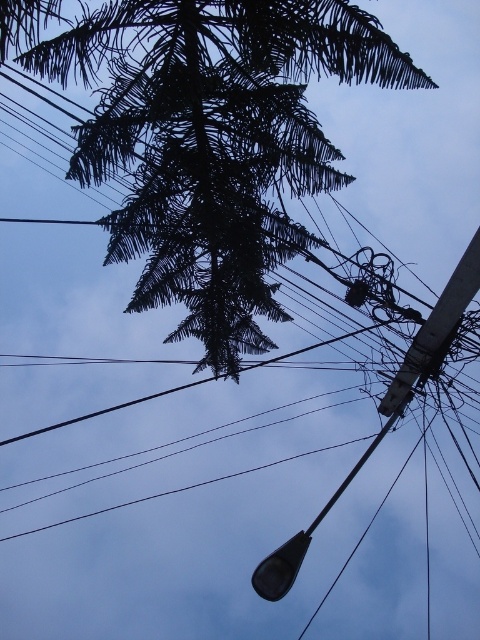
Question: Is dark green textured tree at upper center to the left of matte gray streetlight at lower center from the viewer's perspective?

Choices:
 (A) yes
 (B) no

Answer: (A)

Question: Which point appears farthest from the camera in this image?

Choices:
 (A) (399, 400)
 (B) (165, 109)

Answer: (A)

Question: Does dark green textured tree at upper center have a larger size compared to matte gray streetlight at lower center?

Choices:
 (A) no
 (B) yes

Answer: (B)

Question: Can you confirm if dark green textured tree at upper center is thinner than matte gray streetlight at lower center?

Choices:
 (A) no
 (B) yes

Answer: (A)